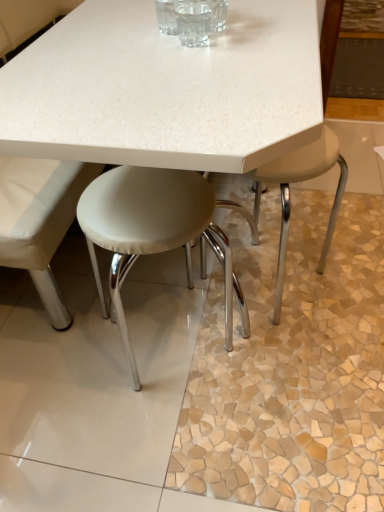
I want to click on free location in front of white leather stool at center, marked as the 2th stool in a right-to-left arrangement, so click(165, 445).